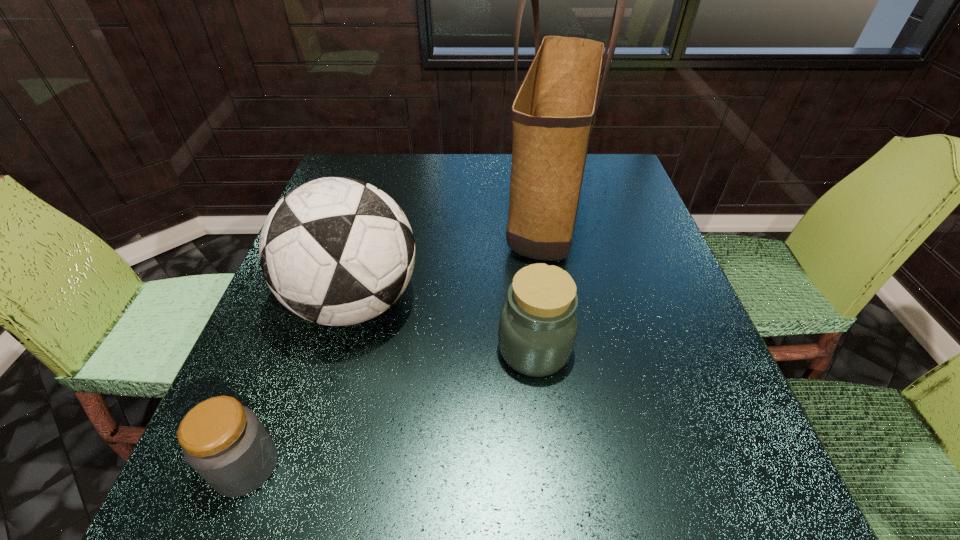
Where is `the closest object to the tallest object`? the closest object to the tallest object is located at coordinates (538, 324).

The height and width of the screenshot is (540, 960). In order to click on object that is the third closest to the taller jar in this screenshot , I will do `click(224, 442)`.

This screenshot has width=960, height=540. I want to click on vacant region that satisfies the following two spatial constraints: 1. on the front side of the farther jar; 2. on the surface of the nearest object near the warning symbol, so click(x=547, y=466).

At what (x,y) coordinates should I click in order to perform the action: click on vacant space that satisfies the following two spatial constraints: 1. on the front side of the tallest object; 2. on the surface of the second tallest object where the brand logo is visible. Please return your answer as a coordinate pair (x, y). Looking at the image, I should click on (564, 302).